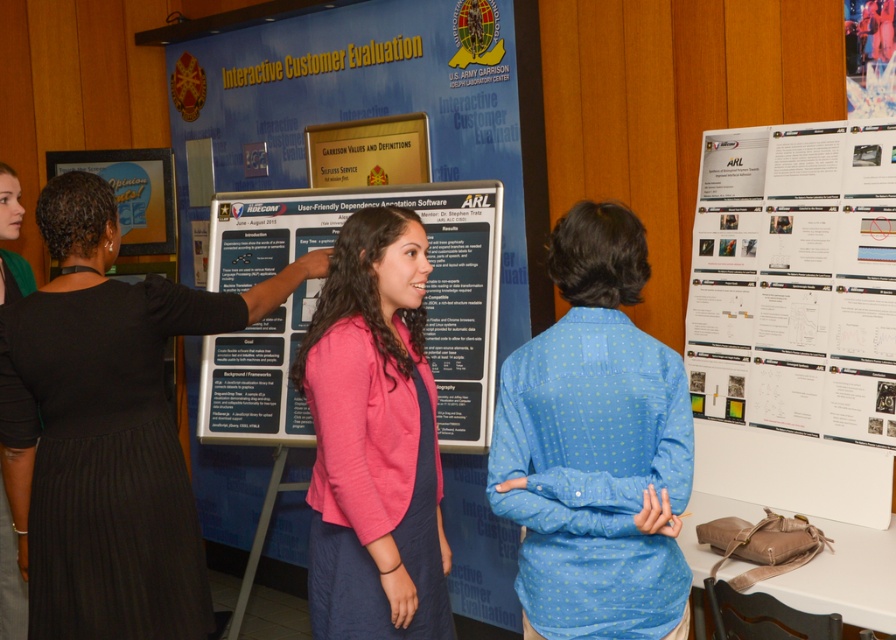
You are attending a conference and see the black dress at center and the white paper at right. Which object is taller?

The black dress at center is taller than the white paper at right.

What is the location of the point with coordinates (x=383, y=200) in the image?

The point with coordinates (x=383, y=200) is located on the blue cardboard poster at center.

You are standing at the point labeled point (55,572) and want to walk to the point labeled point (757,301). Which direction should you turn to face the direction of your destination?

Since point (55,572) is in front of point (757,301), you should turn around to face the direction of point (757,301).